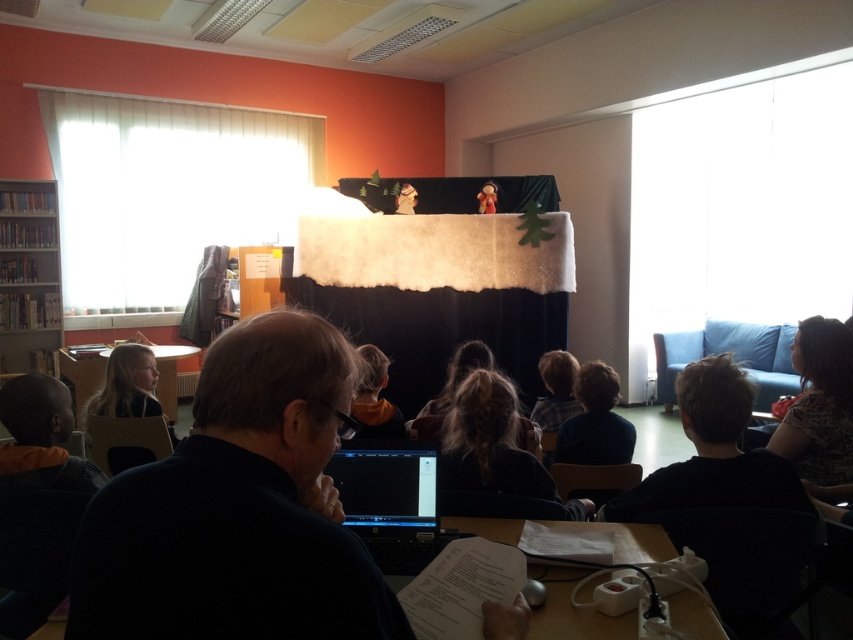
Is wooden bookshelf at left below matte wood table at lower left?

Actually, wooden bookshelf at left is above matte wood table at lower left.

Which is behind, point (49, 300) or point (167, 355)?

The point (49, 300) is behind.

Where is `wooden bookshelf at left`? wooden bookshelf at left is located at coordinates pos(28,275).

You are a GUI agent. You are given a task and a screenshot of the screen. Output one action in this format:
    pyautogui.click(x=<x>, y=<y>)
    Task: Click on the wooden bookshelf at left
    The width and height of the screenshot is (853, 640).
    Given the screenshot: What is the action you would take?
    pyautogui.click(x=28, y=275)

What do you see at coordinates (167, 189) in the screenshot? The height and width of the screenshot is (640, 853). I see `white matte projection screen at upper left` at bounding box center [167, 189].

In the scene shown: Which is below, white matte projection screen at upper left or wooden table at center?

wooden table at center

Which is in front, point (276, 128) or point (695, 611)?

Point (695, 611) is more forward.

Identify the location of white matte projection screen at upper left. The width and height of the screenshot is (853, 640). (167, 189).

Between point (142, 289) and point (20, 288), which one is positioned in front?

Positioned in front is point (20, 288).

Can you confirm if white matte projection screen at upper left is positioned above wooden bookshelf at left?

Yes.

Is point (73, 189) behind point (4, 305)?

Yes, point (73, 189) is behind point (4, 305).

Locate an element on the screen. white matte projection screen at upper left is located at coordinates (167, 189).